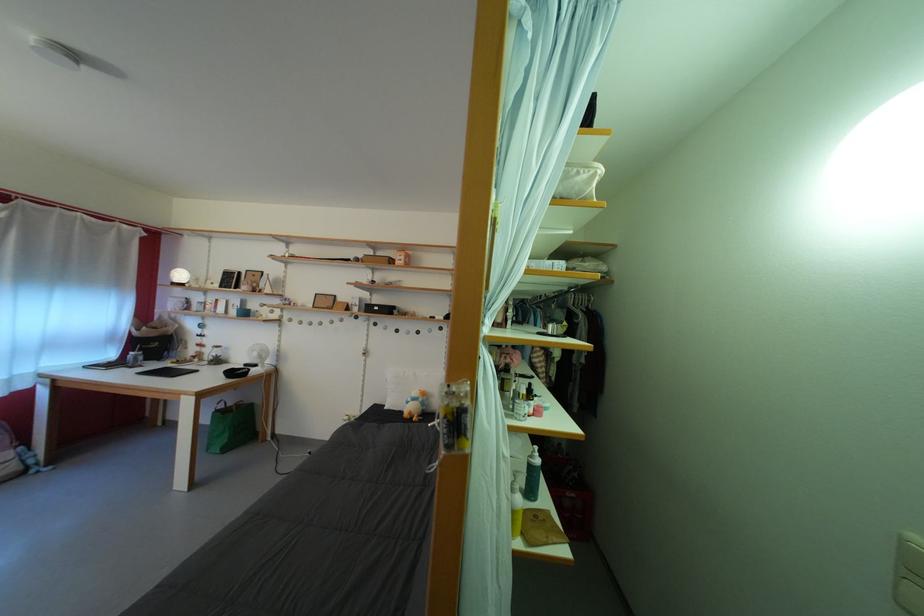
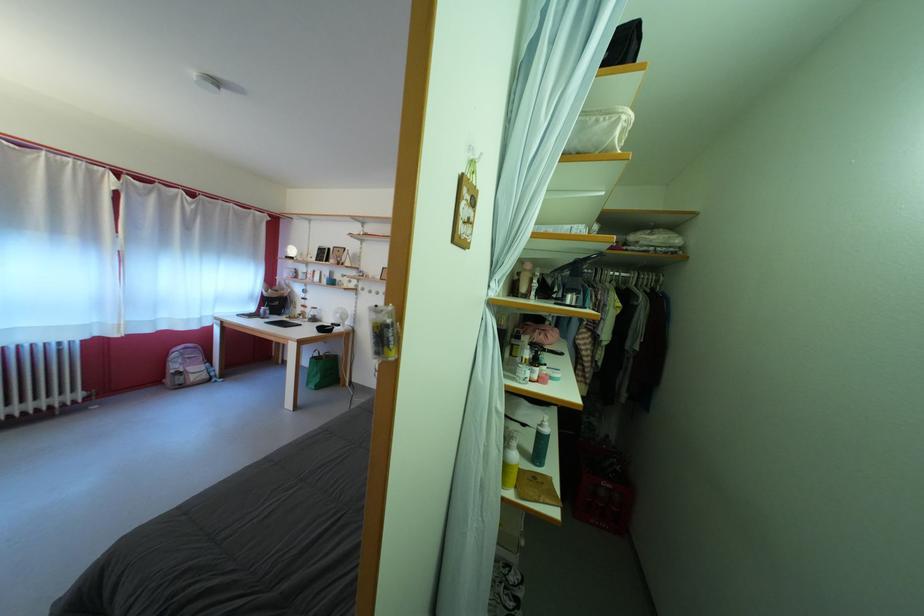
The point at (226, 368) is marked in the first image. Where is the corresponding point in the second image?

(322, 325)